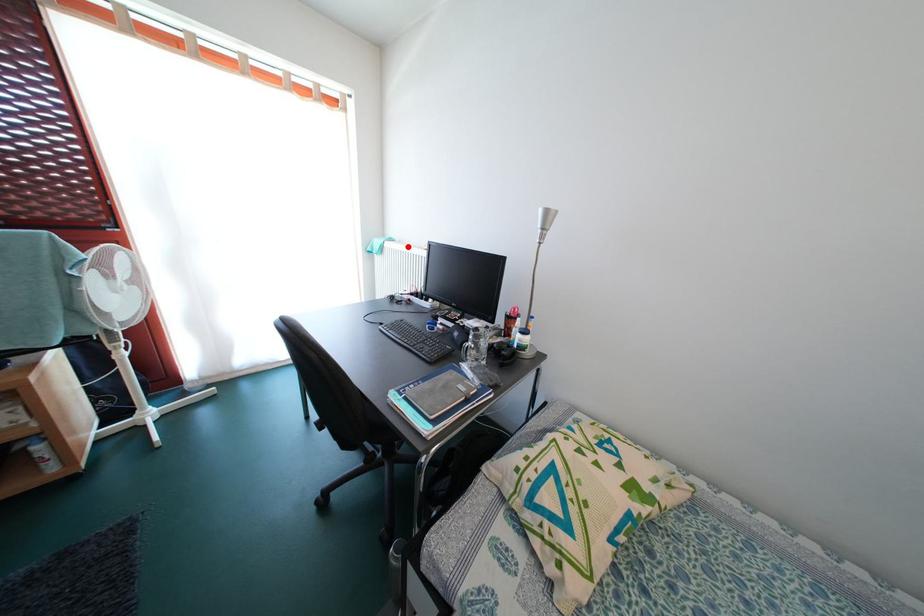
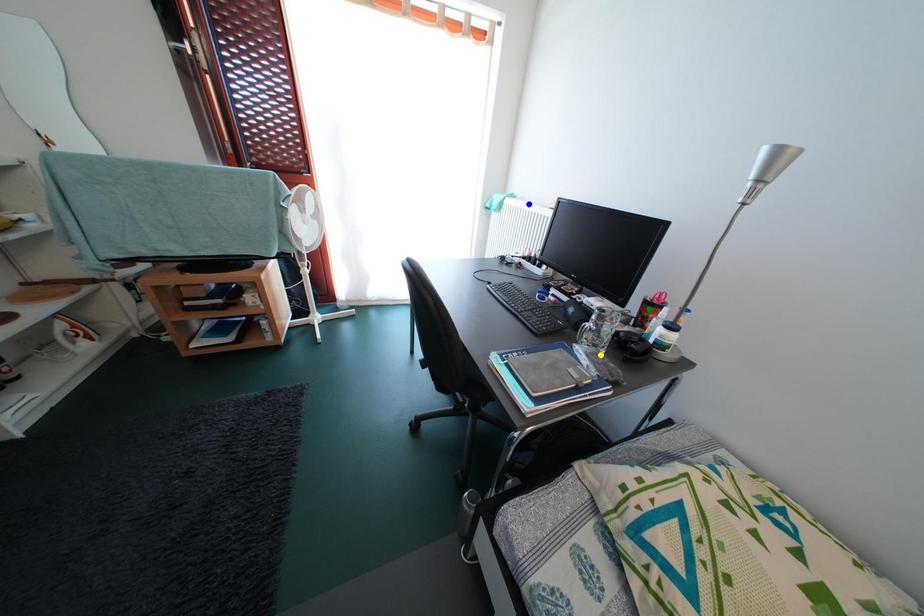
Question: I am providing you with two images of the same scene from different viewpoints. A red point is marked on the first image. You are given multiple points on the second image. Can you choose the point in image 2 that corresponds to the point in image 1?

Choices:
 (A) yellow point
 (B) green point
 (C) blue point

Answer: (C)